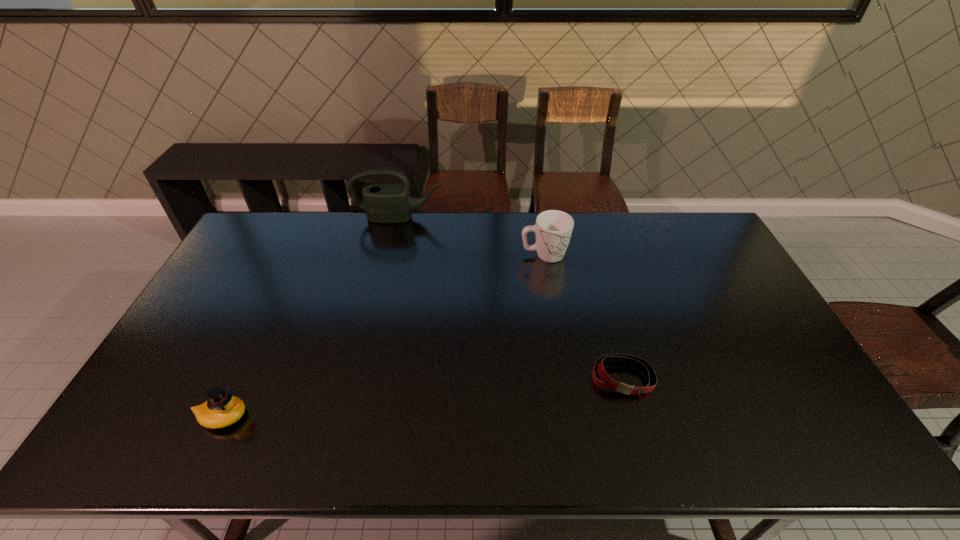
Where is `object that is the closest one to the second object from left to right`? object that is the closest one to the second object from left to right is located at coordinates pos(553,228).

Where is `blank space that satisfies the following two spatial constraints: 1. on the spout of the third object from right to left; 2. on the right side of the shortest object`? Image resolution: width=960 pixels, height=540 pixels. blank space that satisfies the following two spatial constraints: 1. on the spout of the third object from right to left; 2. on the right side of the shortest object is located at coordinates (363, 378).

You are a GUI agent. You are given a task and a screenshot of the screen. Output one action in this format:
    pyautogui.click(x=<x>, y=<y>)
    Task: Click on the free spot that satisfies the following two spatial constraints: 1. on the spout of the watering can; 2. on the front-facing side of the nearest object
    
    Given the screenshot: What is the action you would take?
    pyautogui.click(x=353, y=417)

The width and height of the screenshot is (960, 540). Find the location of `vacant space that satisfies the following two spatial constraints: 1. on the side of the second nearest object with the handle; 2. on the right side of the mug`. vacant space that satisfies the following two spatial constraints: 1. on the side of the second nearest object with the handle; 2. on the right side of the mug is located at coordinates (564, 378).

Image resolution: width=960 pixels, height=540 pixels. I want to click on free space that satisfies the following two spatial constraints: 1. on the back side of the shortest object; 2. on the side of the third nearest object with the handle, so click(x=588, y=255).